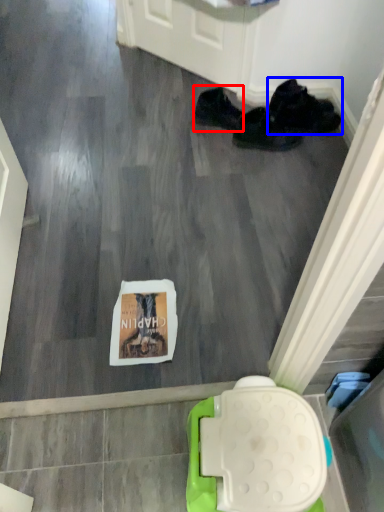
Question: Among these objects, which one is nearest to the camera, footwear (highlighted by a red box) or footwear (highlighted by a blue box)?

Choices:
 (A) footwear
 (B) footwear

Answer: (A)